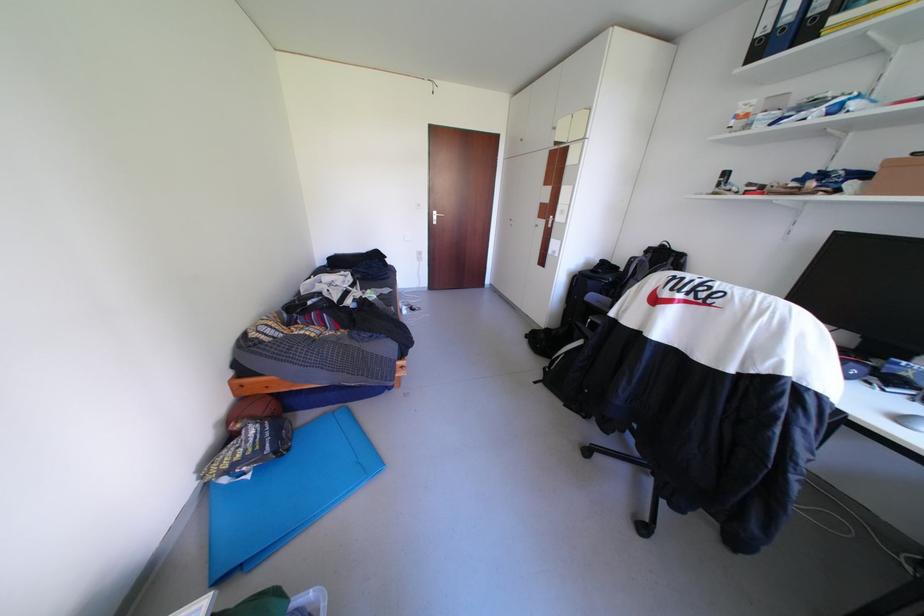
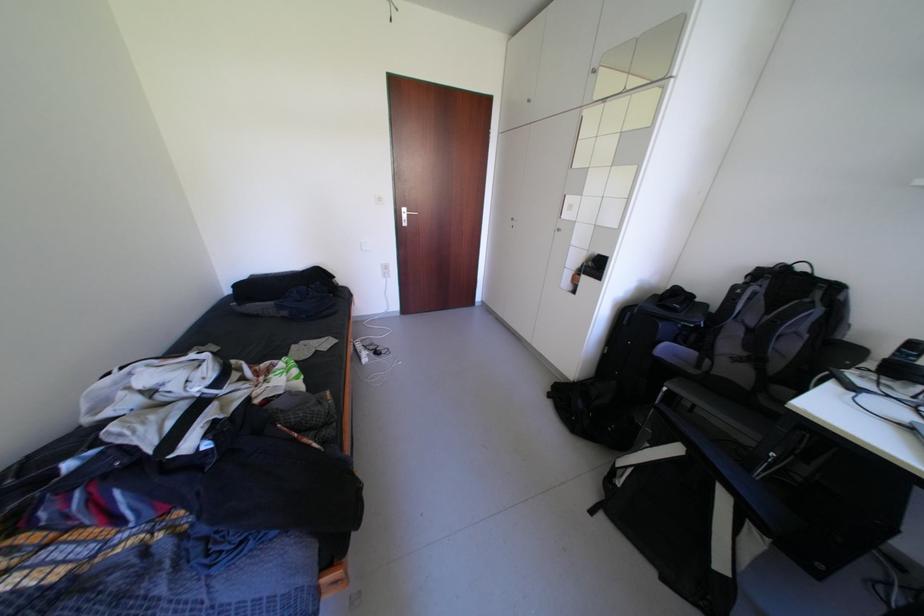
Question: The images are taken continuously from a first-person perspective. In which direction are you moving?

Choices:
 (A) Left
 (B) Right
 (C) Forward
 (D) Backward

Answer: (C)